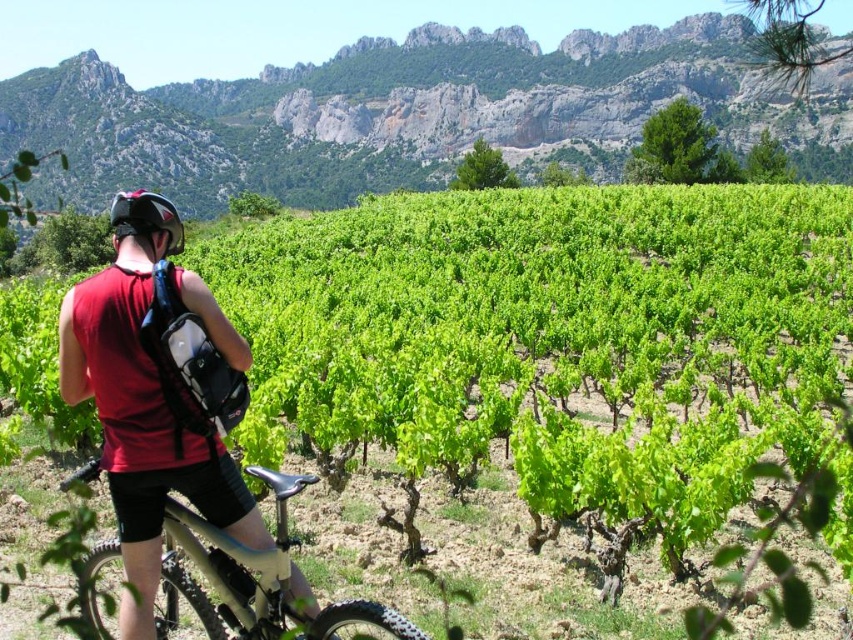
Question: Does rugged stone mountain at upper center appear under matte black tank top at left?

Choices:
 (A) yes
 (B) no

Answer: (B)

Question: Is green leafy vines at center to the right of matte black helmet at upper left from the viewer's perspective?

Choices:
 (A) no
 (B) yes

Answer: (B)

Question: Which of the following is the farthest from the observer?

Choices:
 (A) green leafy vines at center
 (B) metallic silver frame at center
 (C) matte black tank top at left

Answer: (A)

Question: Which point appears closest to the camera in this image?

Choices:
 (A) (253, 588)
 (B) (456, 209)
 (C) (140, 204)

Answer: (A)

Question: Observing the image, what is the correct spatial positioning of rugged stone mountain at upper center in reference to matte black helmet at upper left?

Choices:
 (A) above
 (B) below

Answer: (A)

Question: Which point is closer to the camera taking this photo?

Choices:
 (A) (129, 580)
 (B) (236, 173)

Answer: (A)